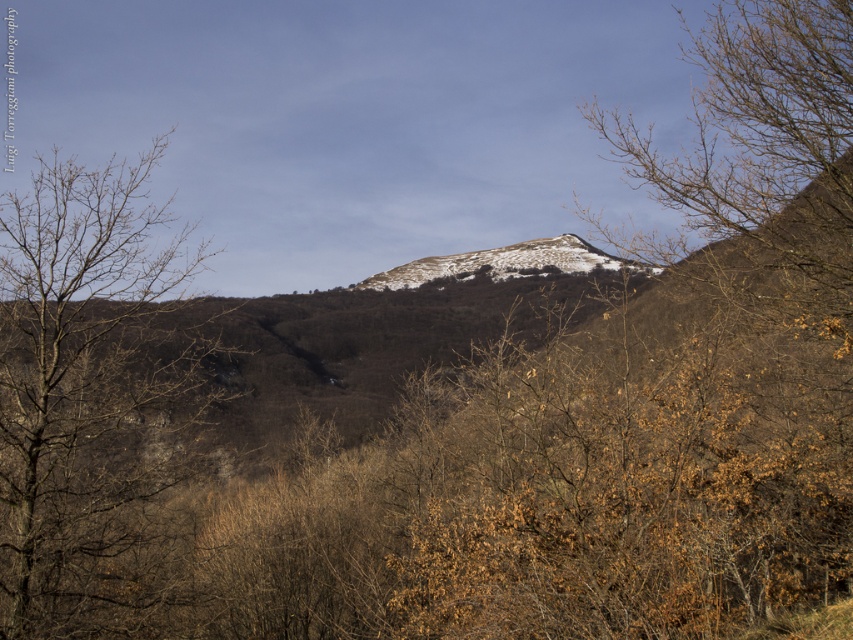
You are an observer standing in the mountain landscape. You notice the bare branches at left and the white powdery snow at center. Which object appears taller in the scene?

The bare branches at left is taller than the white powdery snow at center.

You are a hiker standing at the point marked as point [88,392]. What are you standing on?

You are standing on bare branches at left.

In the scene shown: You are an outdoor photographer planning to capture the contrast between the bare branches at left and the white powdery snow at center. Based on the scene, where should you position your camera to ensure both elements are visible in the same frame?

Position your camera at a lower angle so that the bare branches at left, which are located above the white powdery snow at center, can be captured along with the snow below them in the same frame.